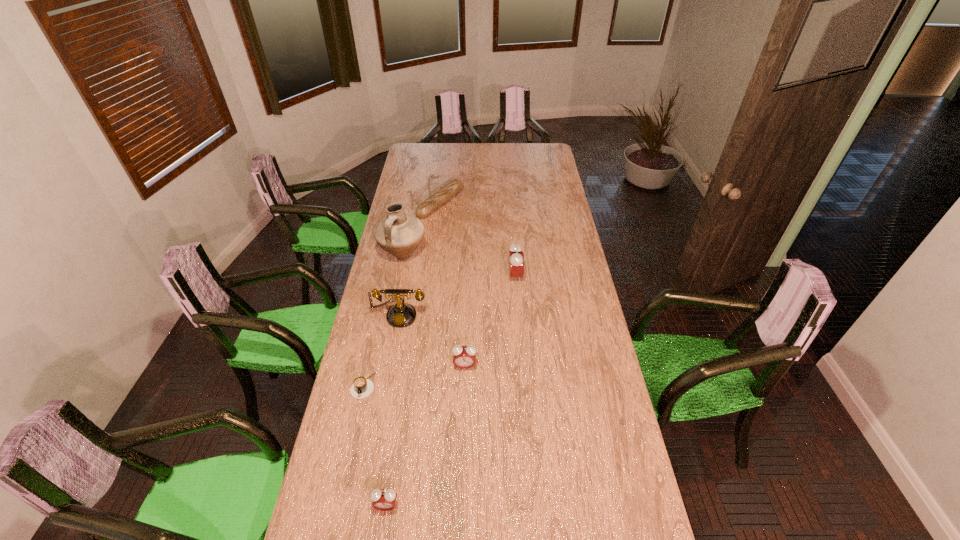
Identify the location of telephone located in the left edge section of the desktop. This screenshot has width=960, height=540. (400, 315).

Identify the location of cappuccino situated at the left edge. This screenshot has height=540, width=960. (362, 387).

In order to click on baguet located at the left edge in this screenshot , I will do `click(433, 202)`.

The height and width of the screenshot is (540, 960). What are the coordinates of `vacant space at the far edge` in the screenshot? It's located at (455, 153).

You are a GUI agent. You are given a task and a screenshot of the screen. Output one action in this format:
    pyautogui.click(x=<x>, y=<y>)
    Task: Click on the vacant space at the near edge of the desktop
    This screenshot has width=960, height=540.
    Given the screenshot: What is the action you would take?
    [x=398, y=494]

Identify the location of free spot at the left edge of the desktop. Image resolution: width=960 pixels, height=540 pixels. (371, 449).

Find the location of a particular element. blank space at the right edge of the desktop is located at coordinates (552, 260).

In the image, there is a desktop. What are the coordinates of `vacant space at the far right corner` in the screenshot? It's located at (531, 143).

Image resolution: width=960 pixels, height=540 pixels. I want to click on free space that is in between the pitcher and the second farthest alarm clock, so click(x=434, y=311).

You are a GUI agent. You are given a task and a screenshot of the screen. Output one action in this format:
    pyautogui.click(x=<x>, y=<y>)
    Task: Click on the free spot between the second nearest alarm clock and the nearest object
    The image size is (960, 540).
    Given the screenshot: What is the action you would take?
    pyautogui.click(x=425, y=436)